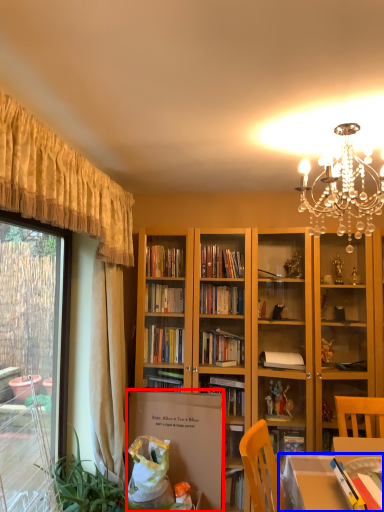
Question: Which point is closer to the camera, cardboard box (highlighted by a red box) or table (highlighted by a blue box)?

Choices:
 (A) cardboard box
 (B) table

Answer: (B)